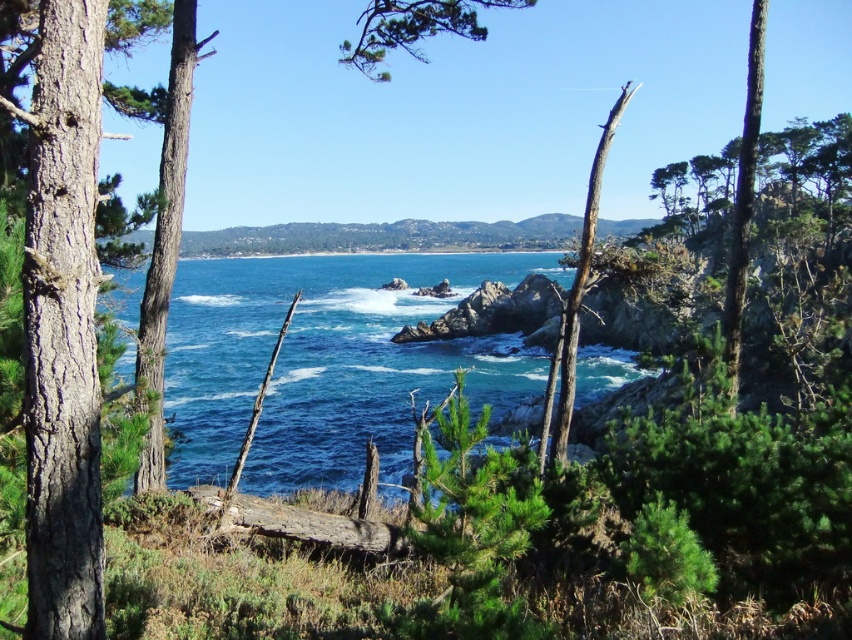
Locate an element on the screen. The height and width of the screenshot is (640, 852). blue smooth water at center is located at coordinates (327, 362).

Is point (476, 280) positioned after point (32, 260)?

Yes, it is behind point (32, 260).

Does point (286, 394) lie in front of point (56, 522)?

No, it is behind (56, 522).

I want to click on blue smooth water at center, so click(x=327, y=362).

Is blue smooth water at center thinner than green textured pine tree at center?

No, blue smooth water at center is not thinner than green textured pine tree at center.

Measure the distance between blue smooth water at center and green textured pine tree at center.

blue smooth water at center is 248.21 feet from green textured pine tree at center.

Between point (367, 314) and point (510, 513), which one is positioned behind?

The point (367, 314) is more distant.

What are the coordinates of `blue smooth water at center` in the screenshot? It's located at (327, 362).

Looking at this image, who is shorter, green textured pine tree at center or brown rough bark tree at center?

With less height is green textured pine tree at center.

Does green textured pine tree at center come behind brown rough bark tree at center?

That is False.

Based on the photo, who is more distant from viewer, (448, 609) or (586, 212)?

The point (586, 212) is more distant.

Locate an element on the screen. Image resolution: width=852 pixels, height=640 pixels. green textured pine tree at center is located at coordinates (470, 529).